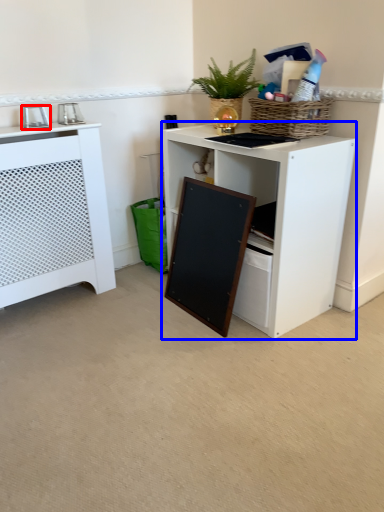
Question: Which of the following is the farthest to the observer, appliance (highlighted by a red box) or desk (highlighted by a blue box)?

Choices:
 (A) appliance
 (B) desk

Answer: (A)